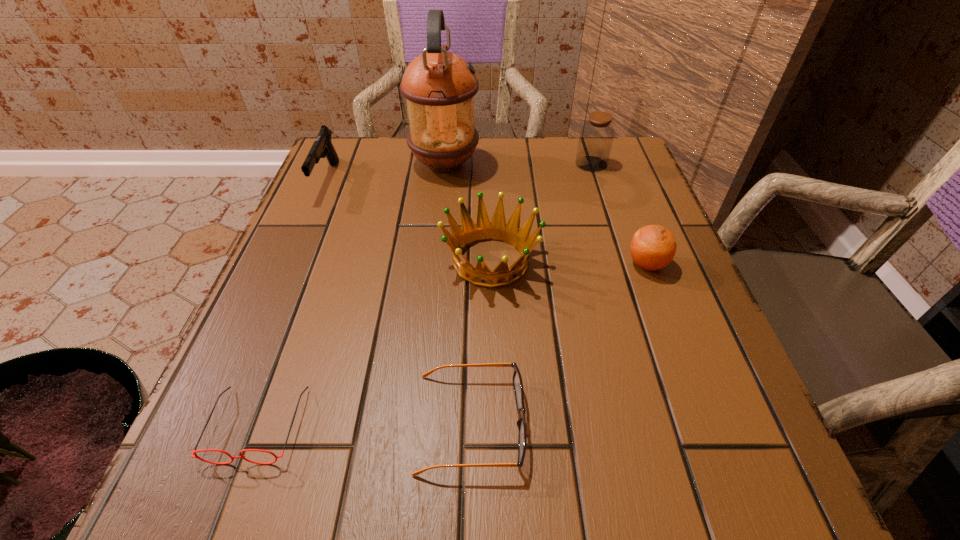
The width and height of the screenshot is (960, 540). In order to click on oil lamp in this screenshot , I will do pos(439,86).

The width and height of the screenshot is (960, 540). I want to click on the sixth shortest object, so click(x=596, y=137).

Locate an element on the screen. The height and width of the screenshot is (540, 960). gun is located at coordinates (322, 147).

The image size is (960, 540). In order to click on crown in this screenshot , I will do `click(470, 233)`.

At what (x,y) coordinates should I click in order to perform the action: click on orange. Please return your answer as a coordinate pair (x, y). Looking at the image, I should click on (653, 247).

Locate an element on the screen. the left spectacles is located at coordinates (194, 452).

Where is `the right spectacles`? This screenshot has height=540, width=960. the right spectacles is located at coordinates (517, 382).

What are the coordinates of `vacant point located 0.110m on the left of the oil lamp` in the screenshot? It's located at (367, 164).

You are a GUI agent. You are given a task and a screenshot of the screen. Output one action in this format:
    pyautogui.click(x=<x>, y=<y>)
    Task: Click on the free space located on the left of the second tallest object
    Image resolution: width=960 pixels, height=540 pixels.
    Given the screenshot: What is the action you would take?
    pyautogui.click(x=417, y=164)

The height and width of the screenshot is (540, 960). I want to click on vacant space located at the aiming end of the gun, so click(272, 310).